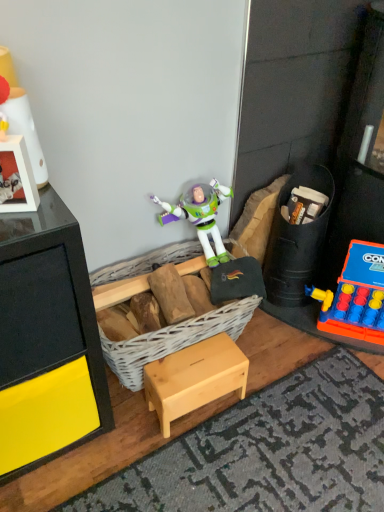
Question: Is white wicker basket at center thinner than rubberized plastic toy at right, arranged as the 1th toy when viewed from the back?

Choices:
 (A) yes
 (B) no

Answer: (B)

Question: Is white wicker basket at center not close to rubberized plastic toy at right, which is the second toy from left to right?

Choices:
 (A) no
 (B) yes

Answer: (A)

Question: Is white wicker basket at center to the right of rubberized plastic toy at right, arranged as the 1th toy when viewed from the back, from the viewer's perspective?

Choices:
 (A) no
 (B) yes

Answer: (A)

Question: From a real-world perspective, is white wicker basket at center located higher than rubberized plastic toy at right, which is the second toy from left to right?

Choices:
 (A) yes
 (B) no

Answer: (B)

Question: Is white wicker basket at center surrounding rubberized plastic toy at right, the second toy positioned from the right?

Choices:
 (A) no
 (B) yes

Answer: (A)

Question: Does point (223, 379) appear closer or farther from the camera than point (193, 338)?

Choices:
 (A) closer
 (B) farther

Answer: (A)

Question: From the image's perspective, is natural wood stool at center above or below white wicker basket at center?

Choices:
 (A) below
 (B) above

Answer: (A)

Question: From a real-world perspective, relative to white wicker basket at center, is natural wood stool at center vertically above or below?

Choices:
 (A) below
 (B) above

Answer: (A)

Question: In terms of width, does natural wood stool at center look wider or thinner when compared to white wicker basket at center?

Choices:
 (A) thin
 (B) wide

Answer: (A)

Question: Is rubberized plastic toy at right, the 3th toy viewed from the front, taller or shorter than natural wood stool at center?

Choices:
 (A) short
 (B) tall

Answer: (B)

Question: From the image's perspective, is rubberized plastic toy at right, arranged as the 1th toy when viewed from the back, above or below natural wood stool at center?

Choices:
 (A) below
 (B) above

Answer: (B)

Question: Based on their positions, is rubberized plastic toy at right, arranged as the 1th toy when viewed from the back, located to the left or right of natural wood stool at center?

Choices:
 (A) right
 (B) left

Answer: (A)

Question: Considering their positions, is rubberized plastic toy at right, which is the second toy from left to right, located in front of or behind natural wood stool at center?

Choices:
 (A) behind
 (B) front

Answer: (A)

Question: Does point (357, 262) appear closer or farther from the camera than point (9, 104)?

Choices:
 (A) farther
 (B) closer

Answer: (A)

Question: From the image's perspective, is rubberized plastic game at right, positioned as the first toy in right-to-left order, above or below matte white lamp at upper left, which ranks as the third toy in back-to-front order?

Choices:
 (A) below
 (B) above

Answer: (A)